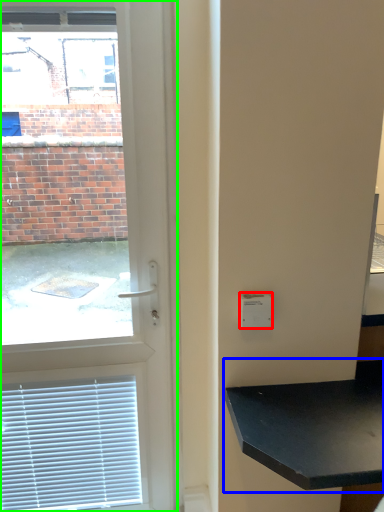
Question: Considering the real-world distances, which object is farthest from light switch (highlighted by a red box)? table (highlighted by a blue box) or door (highlighted by a green box)?

Choices:
 (A) table
 (B) door

Answer: (B)